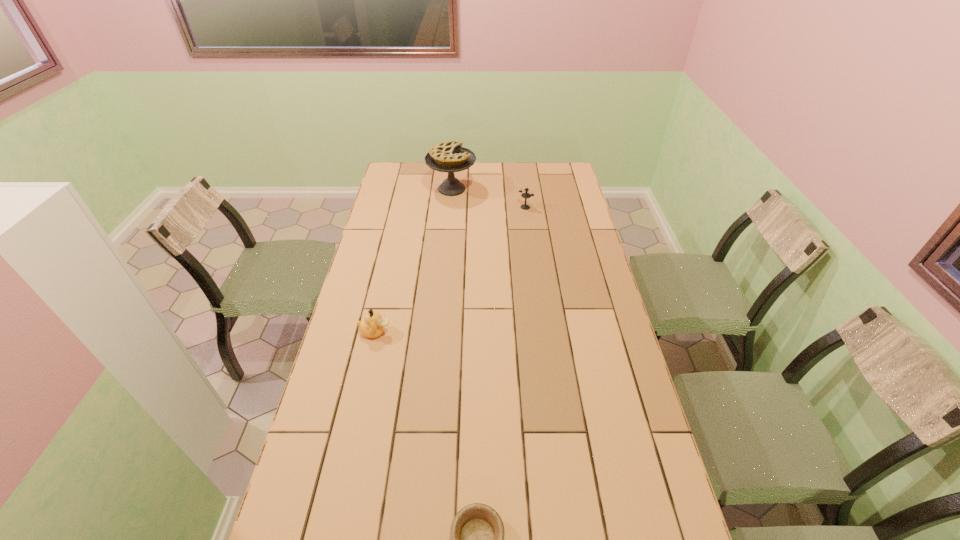
This screenshot has height=540, width=960. I want to click on object present at the left edge, so click(373, 326).

In the image, there is a desktop. Where is `free space at the far edge`? This screenshot has height=540, width=960. free space at the far edge is located at coordinates (441, 180).

This screenshot has height=540, width=960. Find the location of `blank area at the left edge`. blank area at the left edge is located at coordinates (382, 201).

Identify the location of vacant space at the right edge of the desktop. The image size is (960, 540). (636, 445).

Find the location of `free space at the far left corner of the desktop`. free space at the far left corner of the desktop is located at coordinates (419, 183).

Where is `free space between the farthest object and the duckling`? The image size is (960, 540). free space between the farthest object and the duckling is located at coordinates (414, 260).

Where is `blank region between the leftmost object and the rightmost object`? blank region between the leftmost object and the rightmost object is located at coordinates (450, 269).

This screenshot has width=960, height=540. What are the coordinates of `free space between the duckling and the second farthest object` in the screenshot? It's located at (450, 269).

You are a GUI agent. You are given a task and a screenshot of the screen. Output one action in this format:
    pyautogui.click(x=<x>, y=<y>)
    Task: Click on the third closest object to the nearest object
    
    Given the screenshot: What is the action you would take?
    pyautogui.click(x=450, y=157)

In order to click on the second closest object to the third nearest object in this screenshot , I will do point(373,326).